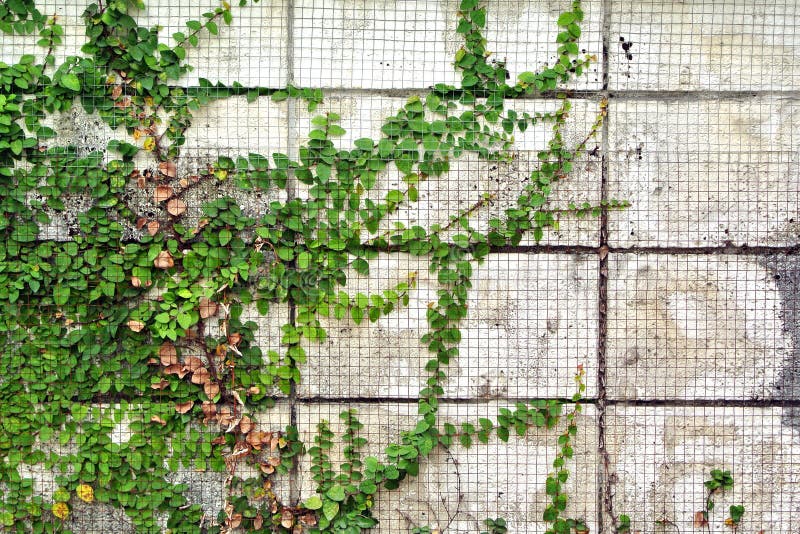
Locate an element on the screen. The height and width of the screenshot is (534, 800). grate is located at coordinates (688, 182), (334, 28), (357, 334), (632, 359), (680, 477), (502, 476), (242, 50), (252, 125).